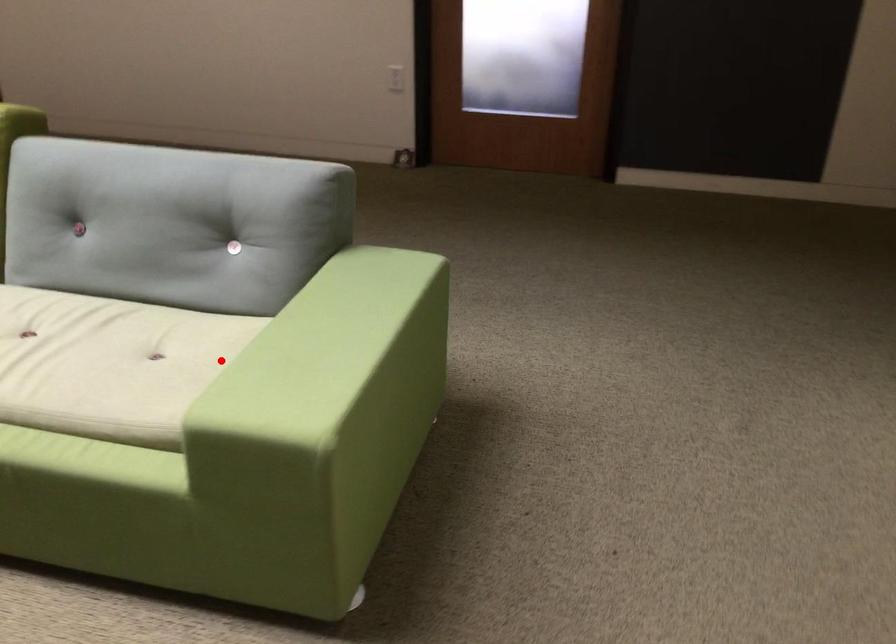
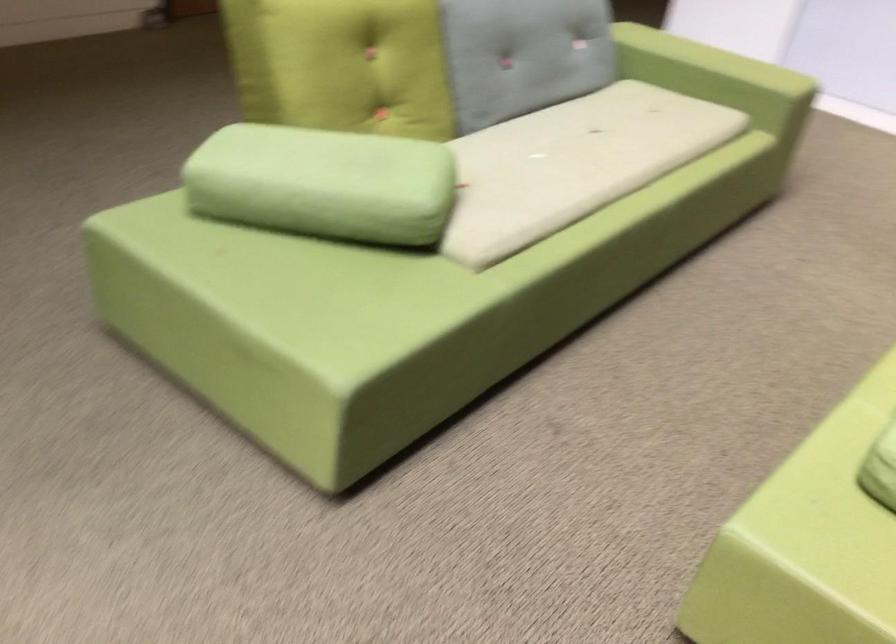
Question: I am providing you with two images of the same scene from different viewpoints. A red point is shown in image1. For the corresponding object point in image2, is it positioned nearer or farther from the camera?

Choices:
 (A) Nearer
 (B) Farther

Answer: (B)